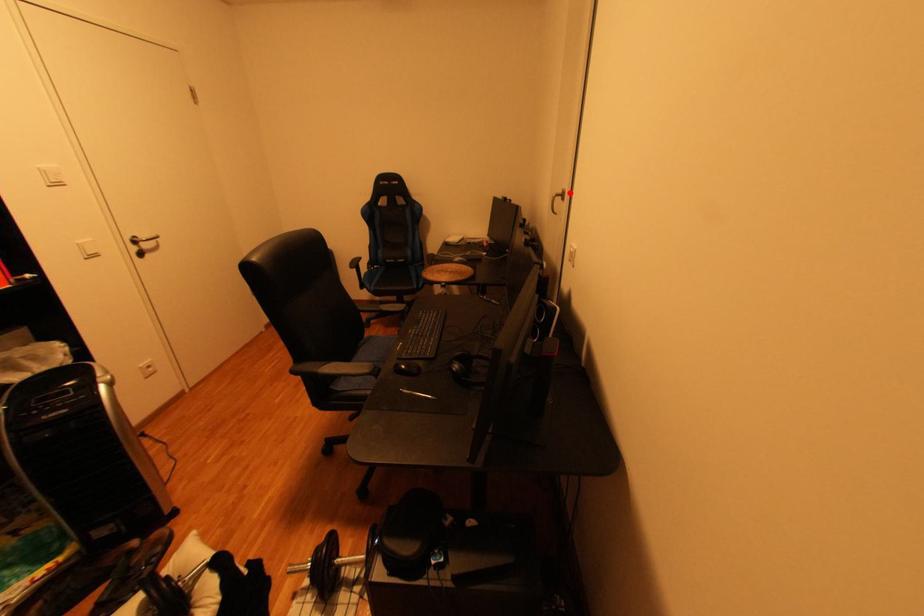
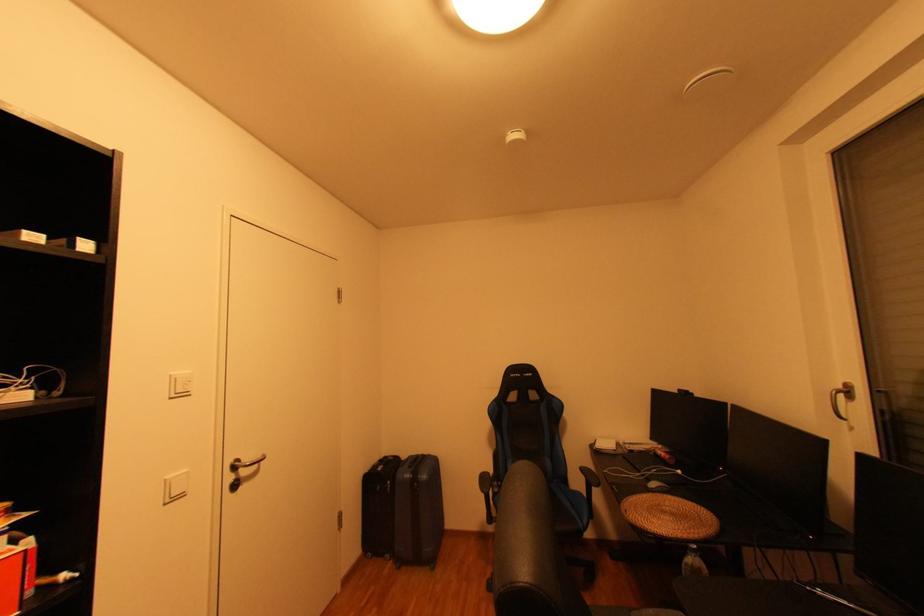
The point at the highlighted location is marked in the first image. Where is the corresponding point in the second image?

(849, 387)